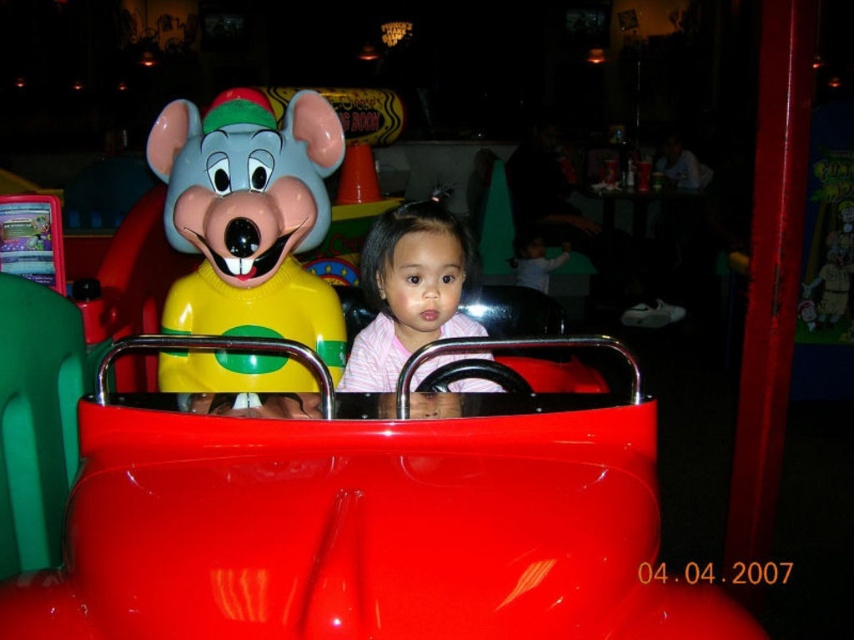
Question: Which point is farther to the camera?

Choices:
 (A) plastic mouse at left
 (B) pink striped shirt at center
 (C) glossy plastic toy car at center

Answer: (A)

Question: Is plastic mouse at left positioned in front of pink striped shirt at center?

Choices:
 (A) no
 (B) yes

Answer: (A)

Question: Does glossy plastic toy car at center lie in front of pink striped shirt at center?

Choices:
 (A) yes
 (B) no

Answer: (A)

Question: Which object is farther from the camera taking this photo?

Choices:
 (A) pink striped shirt at center
 (B) glossy plastic toy car at center

Answer: (A)

Question: Does plastic mouse at left appear under pink striped shirt at center?

Choices:
 (A) yes
 (B) no

Answer: (B)

Question: Which object is the farthest from the glossy plastic toy car at center?

Choices:
 (A) plastic mouse at left
 (B) pink striped shirt at center

Answer: (A)